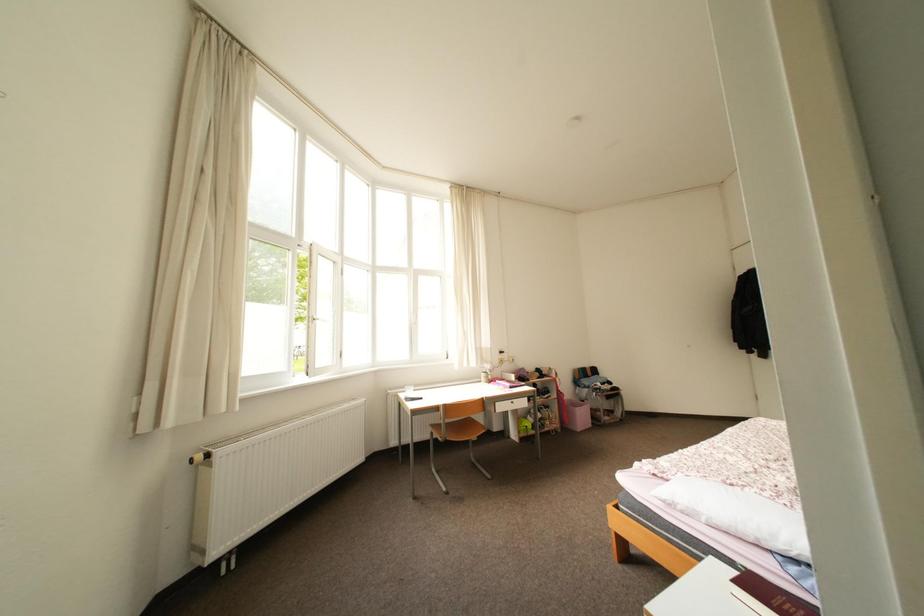
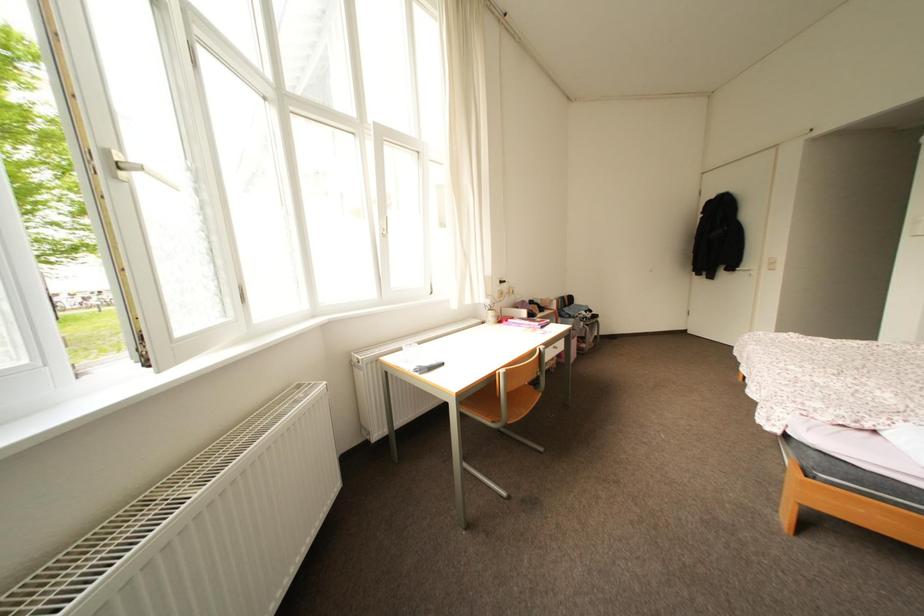
What movement of the cameraman would produce the second image?

The cameraman walked toward left, forward.